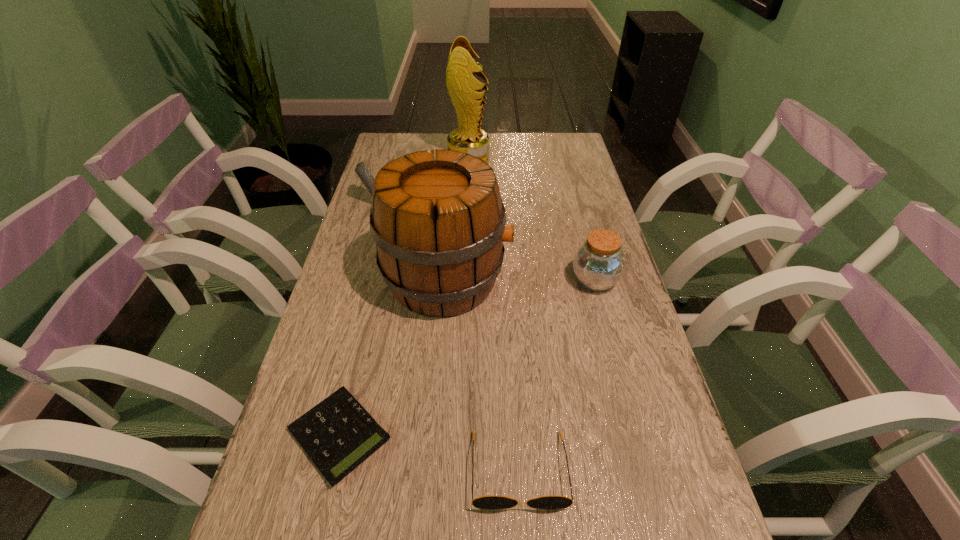
The image size is (960, 540). Find the location of `free space at the far right corner of the desktop`. free space at the far right corner of the desktop is located at coordinates (575, 164).

Where is `free space between the cider and the fifth tallest object`? The height and width of the screenshot is (540, 960). free space between the cider and the fifth tallest object is located at coordinates (483, 375).

In order to click on vacant region between the jar and the cider in this screenshot , I will do `click(520, 280)`.

Point out which object is positioned as the second nearest to the jar. Please provide its 2D coordinates. Your answer should be formatted as a tuple, i.e. [(x, y)], where the tuple contains the x and y coordinates of a point satisfying the conditions above.

[(484, 502)]

Select which object appears as the third closest to the fifth shortest object. Please provide its 2D coordinates. Your answer should be formatted as a tuple, i.e. [(x, y)], where the tuple contains the x and y coordinates of a point satisfying the conditions above.

[(361, 170)]

Where is `calculator that is the second closest one to the fifth tallest object`? This screenshot has width=960, height=540. calculator that is the second closest one to the fifth tallest object is located at coordinates (361, 170).

Locate an element on the screen. This screenshot has height=540, width=960. calculator that stands as the closest to the jar is located at coordinates (337, 434).

The image size is (960, 540). I want to click on vacant space that satisfies the following two spatial constraints: 1. on the front-facing side of the farther calculator; 2. on the left side of the nearer calculator, so click(302, 435).

Where is `free space that satisfies the following two spatial constraints: 1. on the front-facing side of the taller calculator; 2. on the back side of the jar`? free space that satisfies the following two spatial constraints: 1. on the front-facing side of the taller calculator; 2. on the back side of the jar is located at coordinates [x=349, y=281].